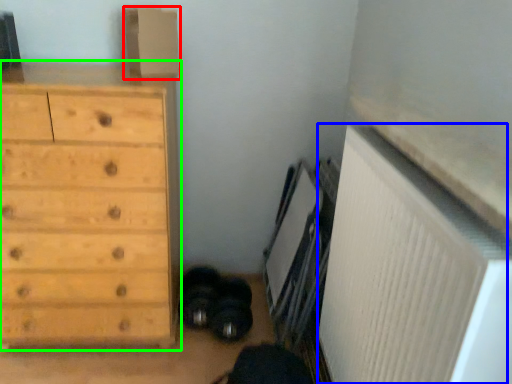
Question: Considering the real-world distances, which object is farthest from cardboard box (highlighted by a red box)? radiator (highlighted by a blue box) or chest of drawers (highlighted by a green box)?

Choices:
 (A) radiator
 (B) chest of drawers

Answer: (A)